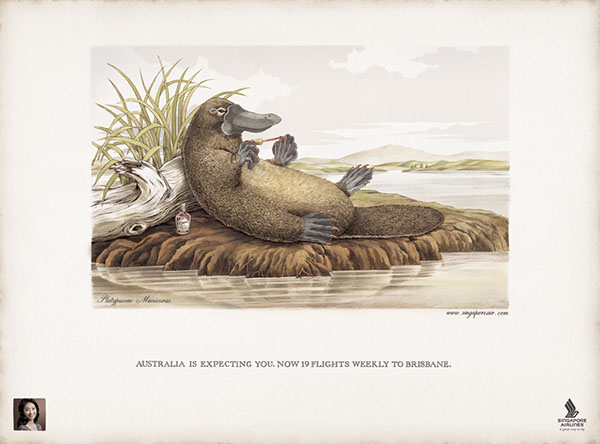
This screenshot has height=444, width=600. I want to click on plant, so click(x=157, y=127).